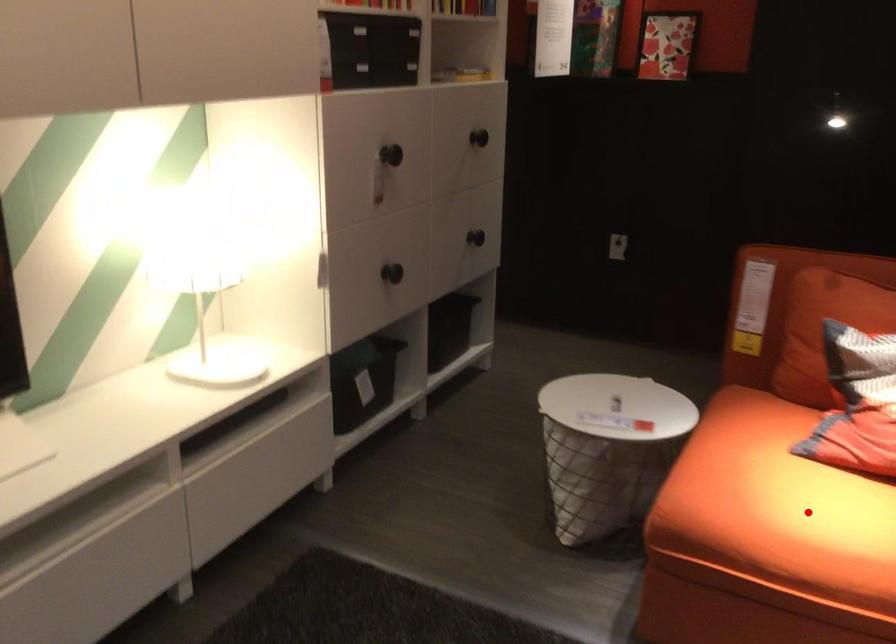
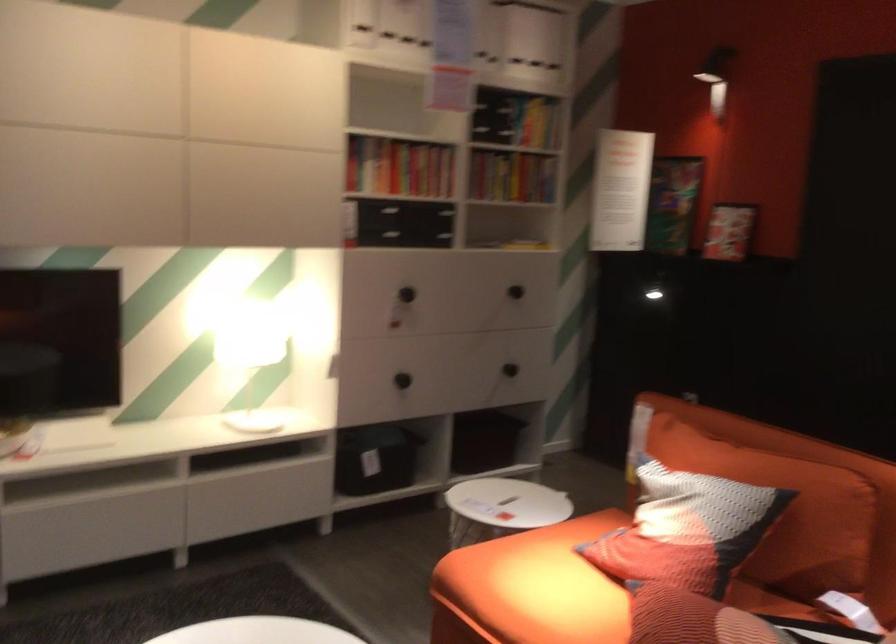
Locate, in the second image, the point that corresponds to the highlighted location in the first image.

(531, 588)